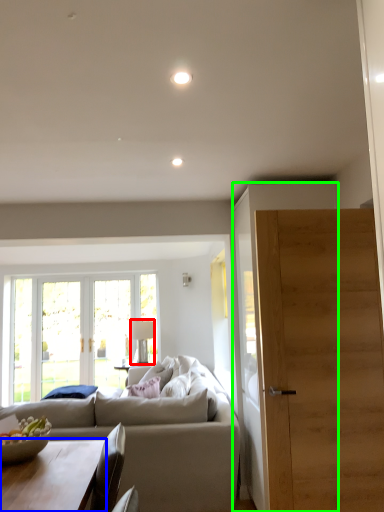
Question: Based on their relative distances, which object is farther from lamp (highlighted by a red box)? Choose from coffee table (highlighted by a blue box) and cabinetry (highlighted by a green box).

Choices:
 (A) coffee table
 (B) cabinetry

Answer: (A)